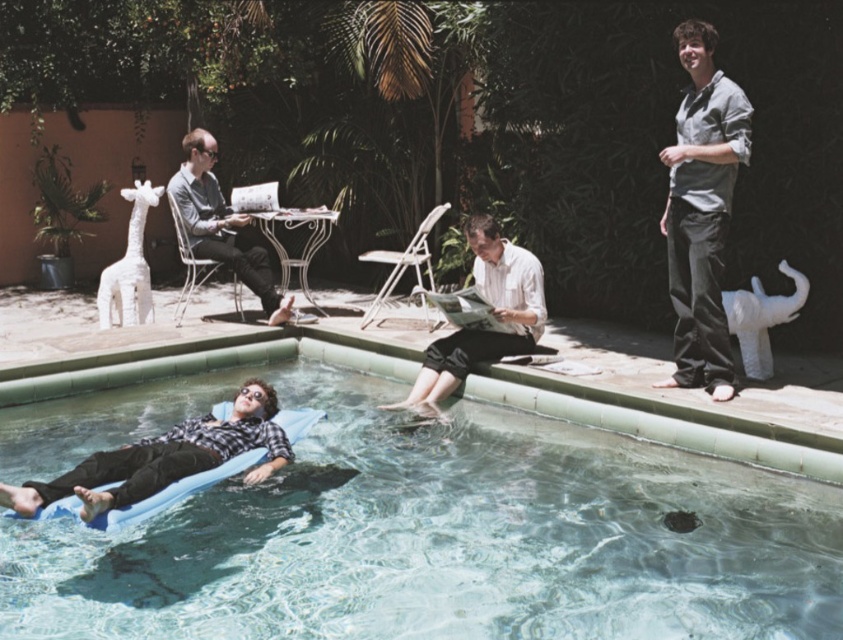
Is point (482, 420) less distant than point (188, 188)?

That is True.

In the scene shown: Can you confirm if clear blue water at lower center is positioned below light gray fabric chair at left?

Indeed, clear blue water at lower center is positioned under light gray fabric chair at left.

This screenshot has width=843, height=640. Find the location of `clear blue water at lower center`. clear blue water at lower center is located at coordinates (423, 518).

Can you confirm if clear blue water at lower center is bigger than gray cotton shirt at upper right?

Correct, clear blue water at lower center is larger in size than gray cotton shirt at upper right.

Does clear blue water at lower center lie behind gray cotton shirt at upper right?

No, it is in front of gray cotton shirt at upper right.

Describe the element at coordinates (423, 518) in the screenshot. I see `clear blue water at lower center` at that location.

Identify the location of clear blue water at lower center. The height and width of the screenshot is (640, 843). (423, 518).

Is clear blue water at lower center wider than blue foam mattress at lower left?

Yes.

Does clear blue water at lower center have a lesser height compared to blue foam mattress at lower left?

Incorrect, clear blue water at lower center's height does not fall short of blue foam mattress at lower left's.

The height and width of the screenshot is (640, 843). Describe the element at coordinates (423, 518) in the screenshot. I see `clear blue water at lower center` at that location.

This screenshot has height=640, width=843. I want to click on clear blue water at lower center, so click(x=423, y=518).